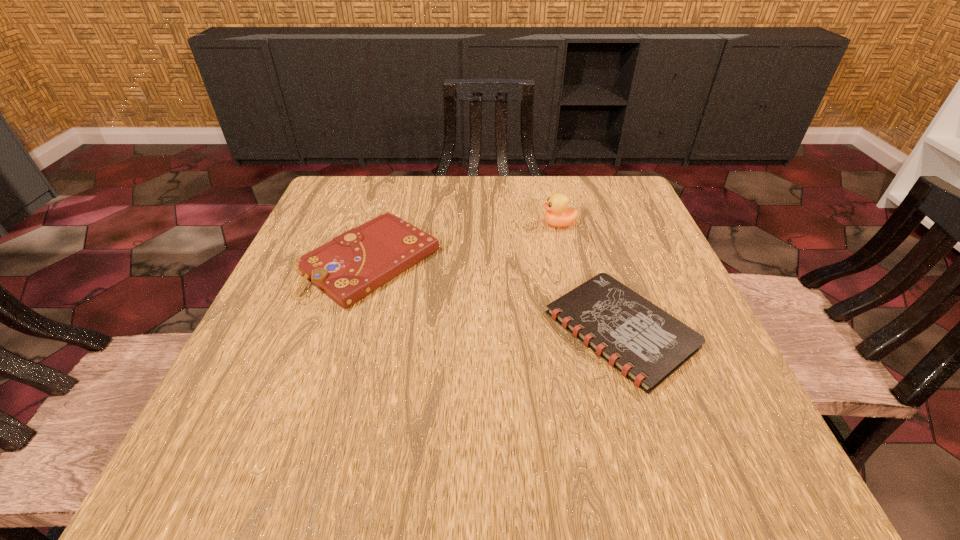
In order to click on the tallest object in this screenshot , I will do `click(558, 214)`.

This screenshot has height=540, width=960. What are the coordinates of `the left notebook` in the screenshot? It's located at (351, 266).

You are a GUI agent. You are given a task and a screenshot of the screen. Output one action in this format:
    pyautogui.click(x=<x>, y=<y>)
    Task: Click on the leftmost object
    This screenshot has height=540, width=960.
    Given the screenshot: What is the action you would take?
    pyautogui.click(x=351, y=266)

Identify the location of the right notebook. This screenshot has height=540, width=960. (646, 344).

Where is `the shorter notebook`? the shorter notebook is located at coordinates (646, 344).

The image size is (960, 540). I want to click on vacant region located on the face of the duckling, so click(x=420, y=224).

The image size is (960, 540). Find the location of `vacant space situated on the face of the duckling`. vacant space situated on the face of the duckling is located at coordinates (470, 224).

The image size is (960, 540). In order to click on free space located 0.280m on the face of the duckling in this screenshot , I will do point(424,224).

Where is `vacant space located on the right of the left notebook`? The width and height of the screenshot is (960, 540). vacant space located on the right of the left notebook is located at coordinates (517, 261).

Locate an element on the screen. This screenshot has height=540, width=960. vacant space situated on the back of the shorter notebook is located at coordinates 585,218.